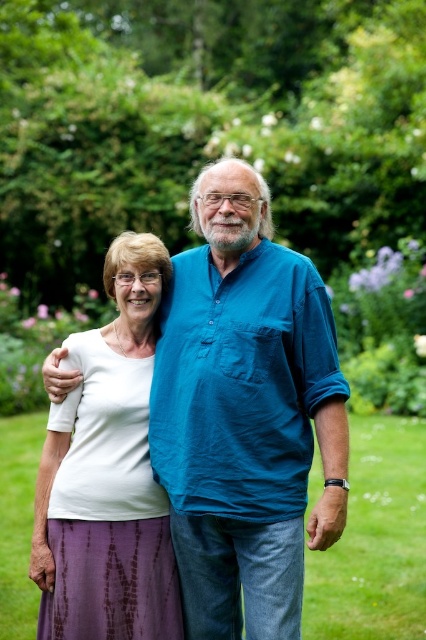
Question: Is white cotton shirt at center smaller than white matte shirt at center?

Choices:
 (A) yes
 (B) no

Answer: (B)

Question: Which of the following is the farthest from the observer?

Choices:
 (A) pyautogui.click(x=282, y=384)
 (B) pyautogui.click(x=83, y=632)

Answer: (A)

Question: Which point is closer to the camera?

Choices:
 (A) (80, 488)
 (B) (344, 432)

Answer: (B)

Question: Is white cotton shirt at center positioned behind white matte shirt at center?

Choices:
 (A) yes
 (B) no

Answer: (B)

Question: Is white cotton shirt at center smaller than white matte shirt at center?

Choices:
 (A) yes
 (B) no

Answer: (B)

Question: Which of the following is the farthest from the observer?

Choices:
 (A) white cotton shirt at center
 (B) white matte shirt at center

Answer: (B)